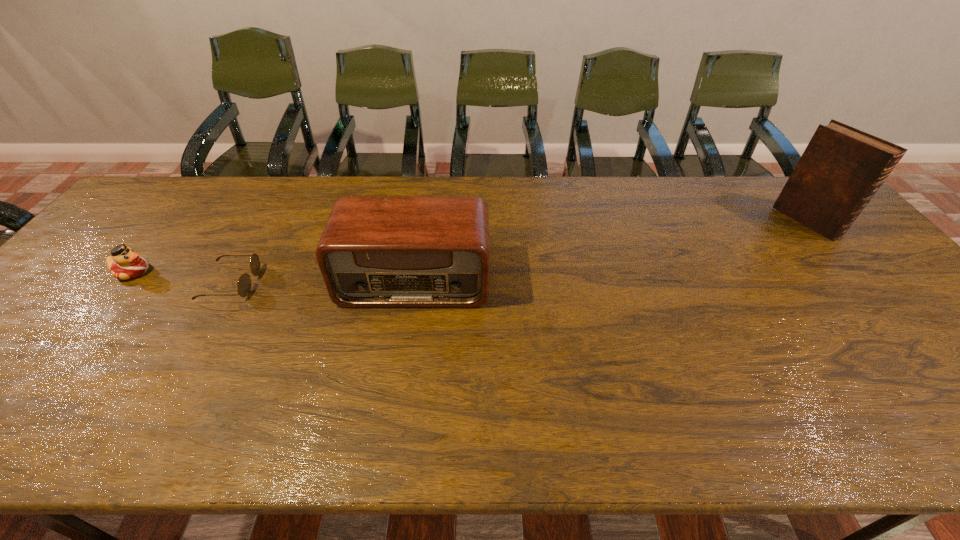
You are a GUI agent. You are given a task and a screenshot of the screen. Output one action in this format:
    pyautogui.click(x=<x>, y=<y>)
    Task: Click on the vacant area that lies between the third tallest object and the sunglasses
    
    Given the screenshot: What is the action you would take?
    pyautogui.click(x=182, y=277)

Locate an element on the screen. free area in between the farthest object and the sunglasses is located at coordinates (519, 252).

Identify the location of free space between the second object from left to right and the farthest object. (519, 252).

The height and width of the screenshot is (540, 960). I want to click on free space between the second object from right to left and the rightmost object, so click(x=611, y=251).

In order to click on free space that is in between the second object from right to left and the rightmost object in this screenshot , I will do `click(611, 251)`.

Where is `free space between the second object from right to left and the duck`? free space between the second object from right to left and the duck is located at coordinates (274, 276).

Find the location of a particular element. Image resolution: width=960 pixels, height=540 pixels. object identified as the third closest to the second shortest object is located at coordinates [x=841, y=169].

The image size is (960, 540). I want to click on object that stands as the closest to the farthest object, so click(374, 251).

Where is `free location that satisfies the following two spatial constraints: 1. on the front panel of the second tallest object; 2. on the lenses of the third object from right to left`? The width and height of the screenshot is (960, 540). free location that satisfies the following two spatial constraints: 1. on the front panel of the second tallest object; 2. on the lenses of the third object from right to left is located at coordinates (415, 283).

Identify the location of vacant space that satisfies the following two spatial constraints: 1. on the front panel of the third shortest object; 2. on the lenses of the sunglasses. (415, 283).